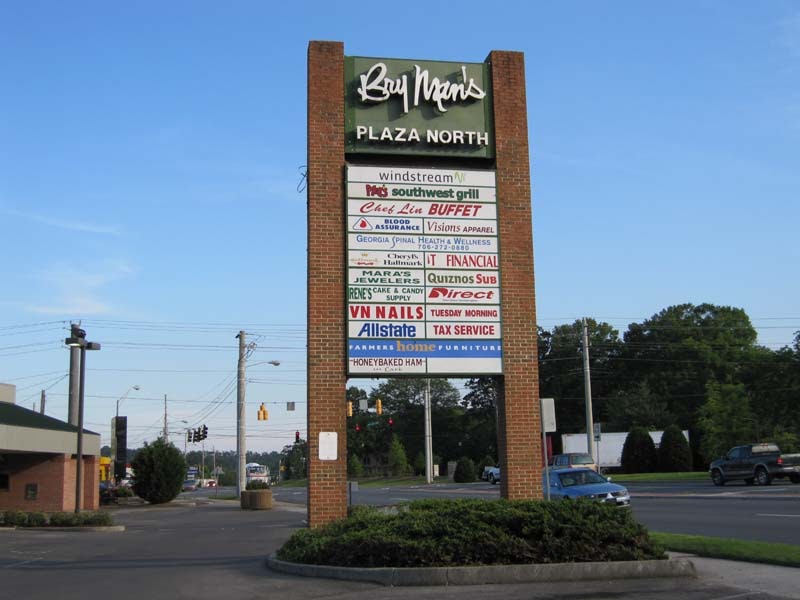
This screenshot has width=800, height=600. What are the coordinates of `cement planter` in the screenshot? It's located at (262, 495).